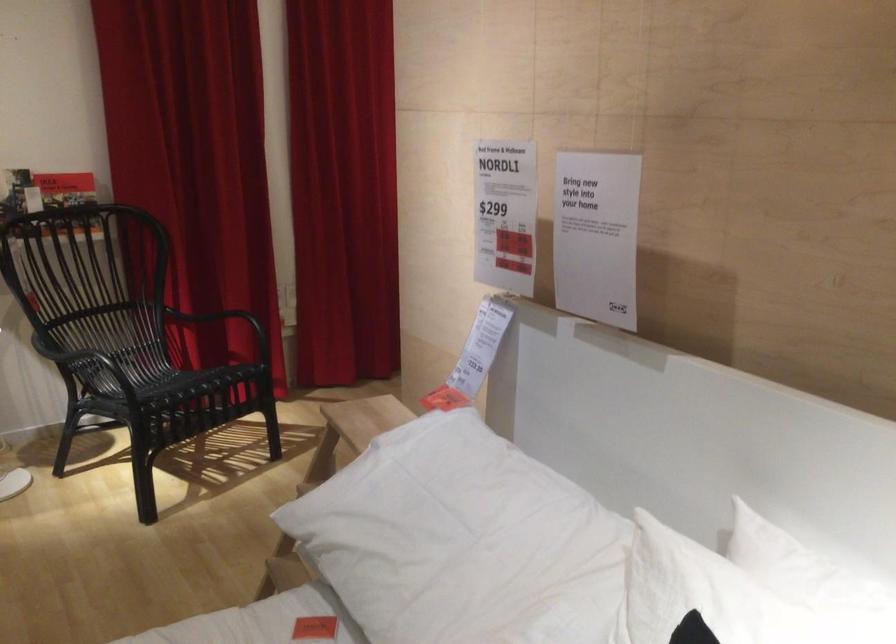
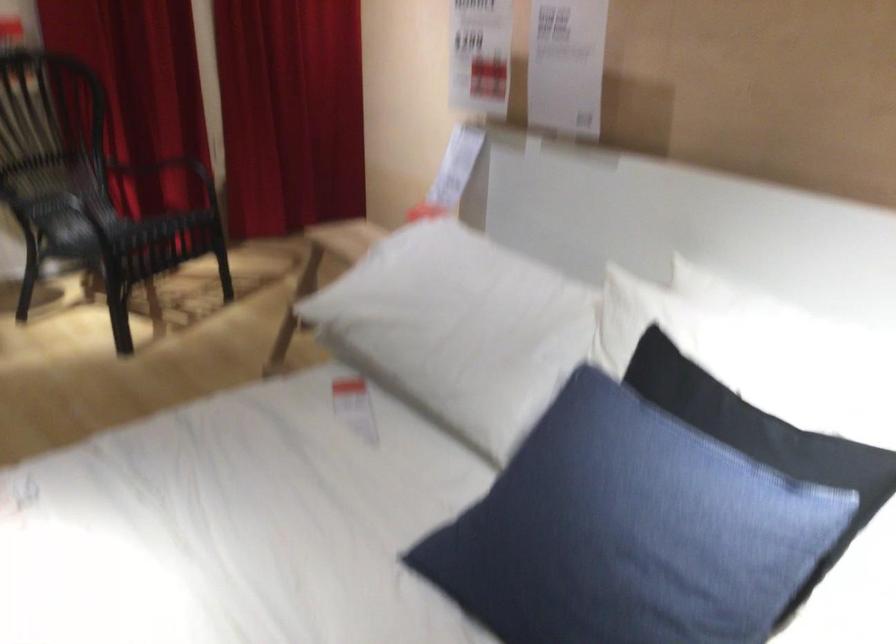
The images are taken continuously from a first-person perspective. In which direction are you moving?

The cameraman moved toward left, backward.